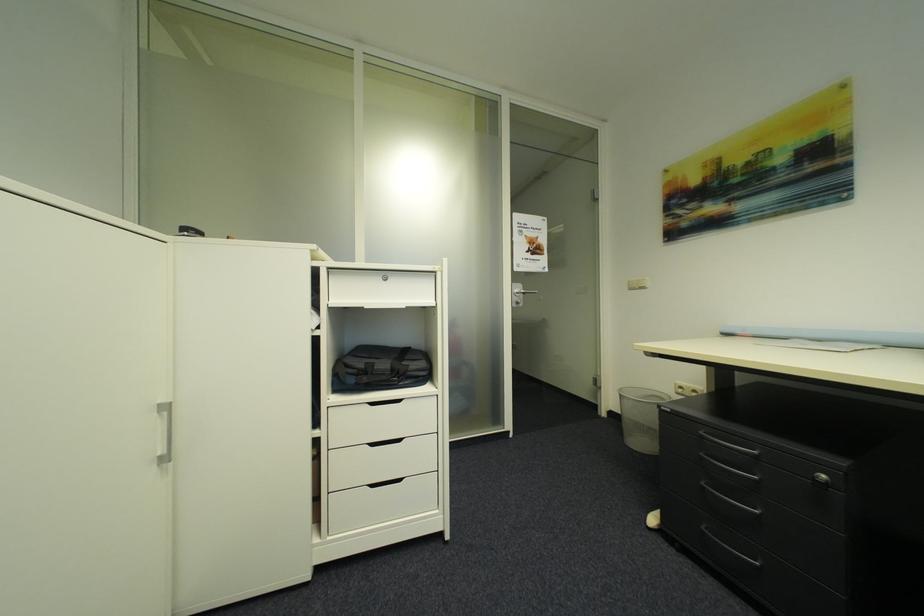
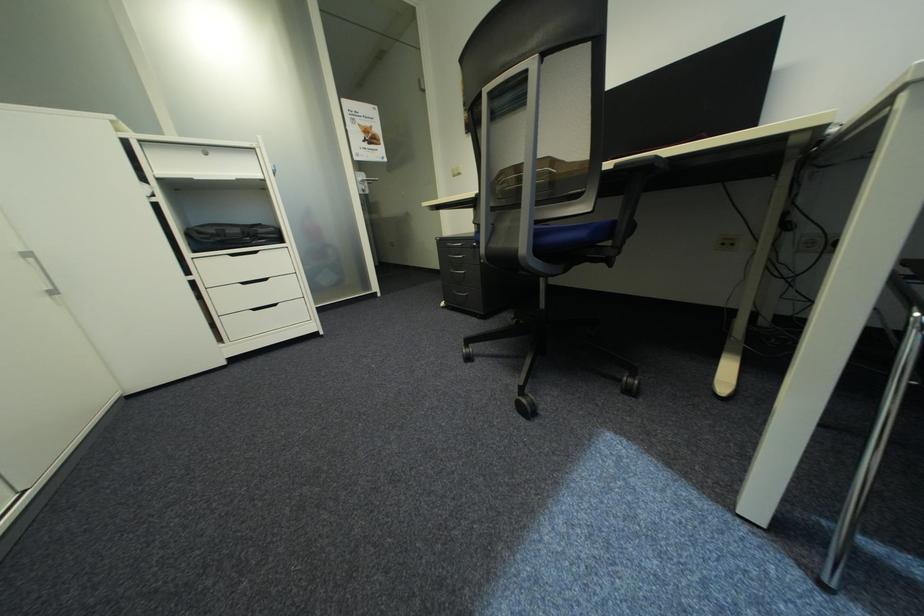
Find the pixel in the second image that matches point 168,451 in the first image.

(55, 288)